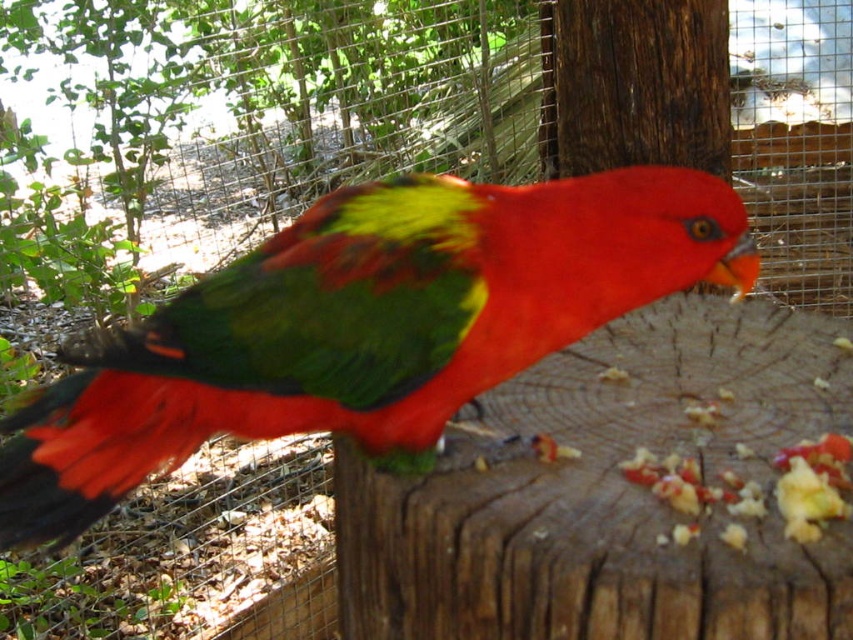
You are a zookeeper checking the enclosure layout. The enclosure has a feeding station at point A and a water station at point B. You need to place a new bird perch so that it is equidistant from both stations. The shiny green parrot at center is represented by point [363,326]. Where should you place the new perch?

The new perch should be placed at the midpoint between point A and point B to ensure it is equidistant from both the feeding station and water station. Since the shiny green parrot at center is represented by point [363,326], this point might be the midpoint if it lies exactly halfway between A and B. Calculate the midpoint coordinates using the formula midpoint_x, midpoint_y. If the given point matches, then that is the correct location.

Consider the image. You are a zookeeper observing the shiny green parrot at center. Based on its coordinates, is it closer to the left or right side of the enclosure?

The shiny green parrot at center is located at point 0.512 on the x and y axis, so it is positioned near the center of the enclosure.